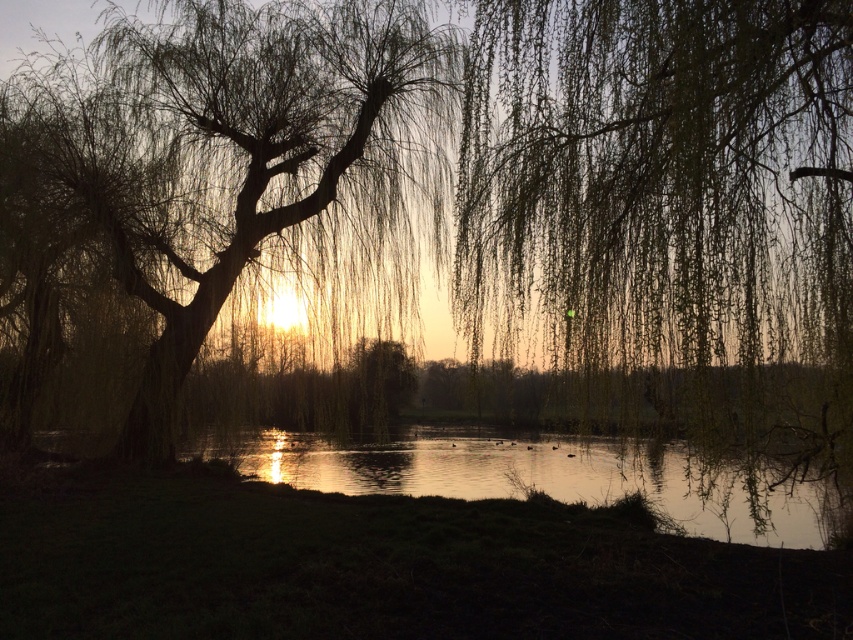
You are standing in the sunset scene and want to place a small decorative rock between the two points, point (x=776, y=106) and point (x=392, y=45). Which point should the rock be closer to if you want it to be nearer to the viewer?

The rock should be placed closer to point (x=776, y=106) because it is closer to the viewer than point (x=392, y=45).

You are a painter standing at the edge of the water in this sunset scene. You want to paint the green leafy willow at center. Where exactly should you position your easel relative to the water to capture its silhouette against the sunset?

The green leafy willow at center is located at coordinates point (x=663, y=184). To capture its silhouette against the sunset, position your easel near the water edge at the specified coordinates so the willow is centered between you and the horizon where the sun is setting.